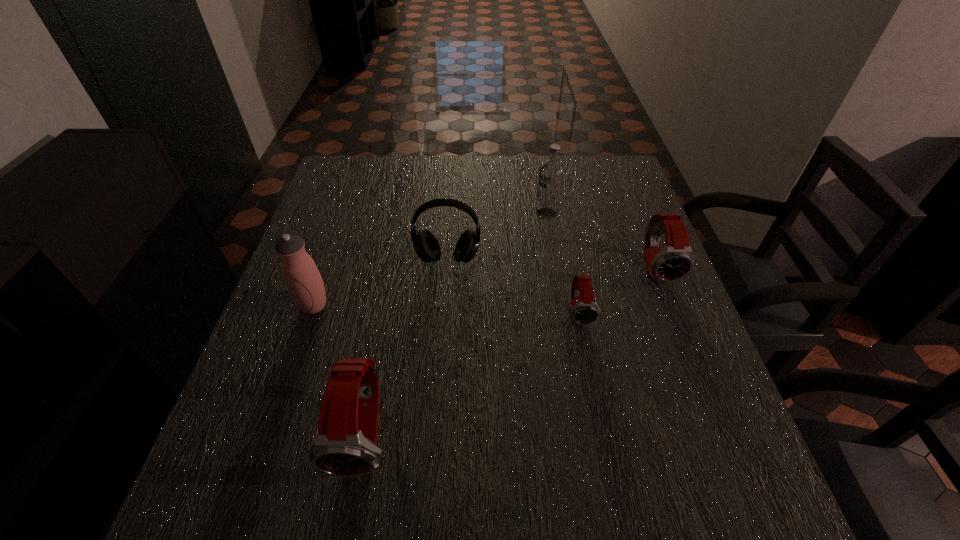
At what (x,y) coordinates should I click in order to perform the action: click on free space for an extra watch to achieve even spacing. Please return your answer as a coordinate pair (x, y). Looking at the image, I should click on (485, 368).